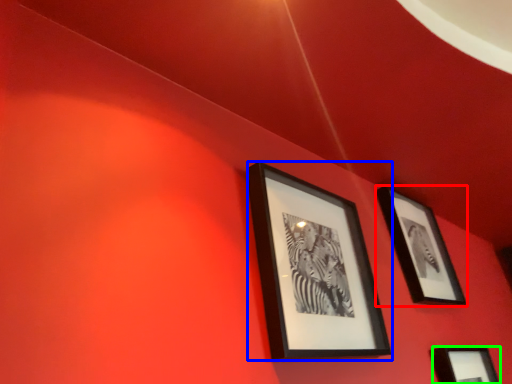
Question: Which object is the farthest from picture frame (highlighted by a red box)? Choose among these: picture frame (highlighted by a blue box) or picture frame (highlighted by a green box).

Choices:
 (A) picture frame
 (B) picture frame

Answer: (A)